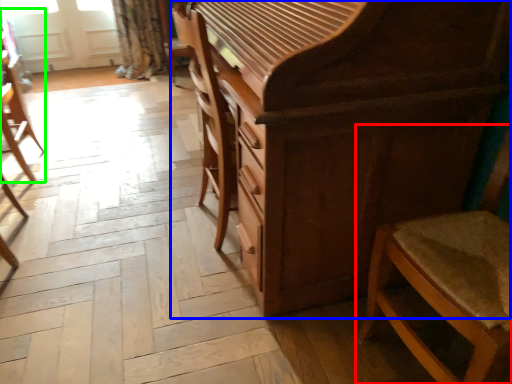
Question: Based on their relative distances, which object is farther from chair (highlighted by a red box)? Choose from chest of drawers (highlighted by a blue box) and chair (highlighted by a green box).

Choices:
 (A) chest of drawers
 (B) chair

Answer: (B)